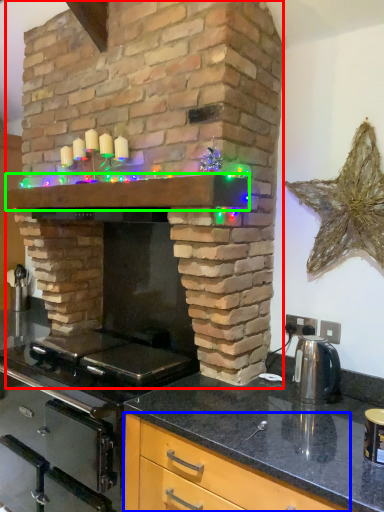
Question: Estimate the real-world distances between objects in this image. Which object is farther from fireplace (highlighted by a red box), cabinetry (highlighted by a blue box) or mantle (highlighted by a green box)?

Choices:
 (A) cabinetry
 (B) mantle

Answer: (A)